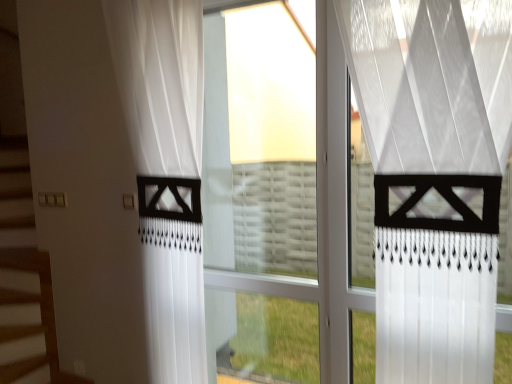
Question: Is white sheer curtain at center, which is the first curtain from front to back, wider or thinner than transparent glass window at center?

Choices:
 (A) thin
 (B) wide

Answer: (B)

Question: Is white sheer curtain at center, the 2th curtain positioned from the back, bigger or smaller than transparent glass window at center?

Choices:
 (A) big
 (B) small

Answer: (A)

Question: Which object is positioned farthest from the transparent glass window at center?

Choices:
 (A) white sheer curtain at left, which is the second curtain in right-to-left order
 (B) white sheer curtain at center, the 2th curtain positioned from the back

Answer: (B)

Question: Which object is positioned closest to the white sheer curtain at left, the 2th curtain viewed from the front?

Choices:
 (A) white sheer curtain at center, the 1th curtain positioned from the right
 (B) transparent glass window at center

Answer: (B)